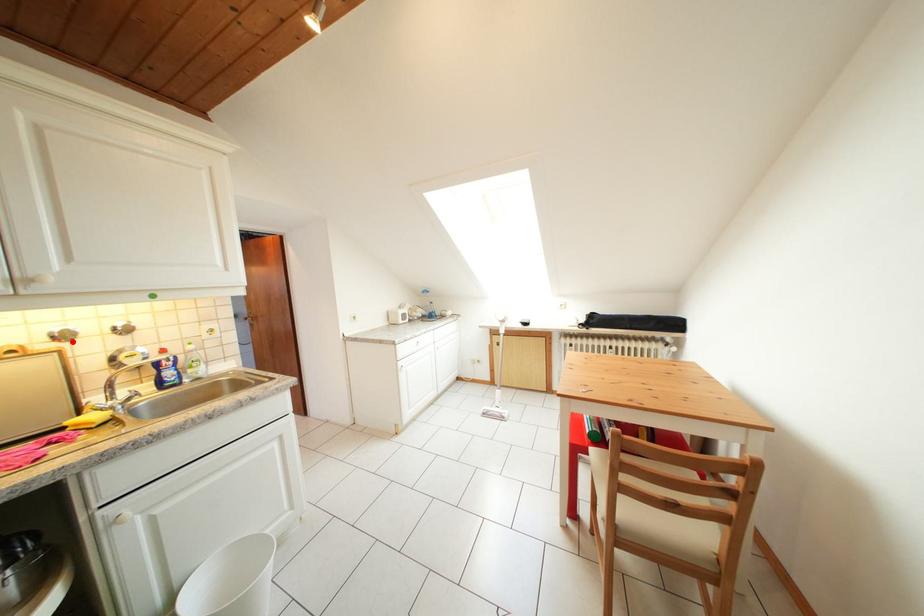
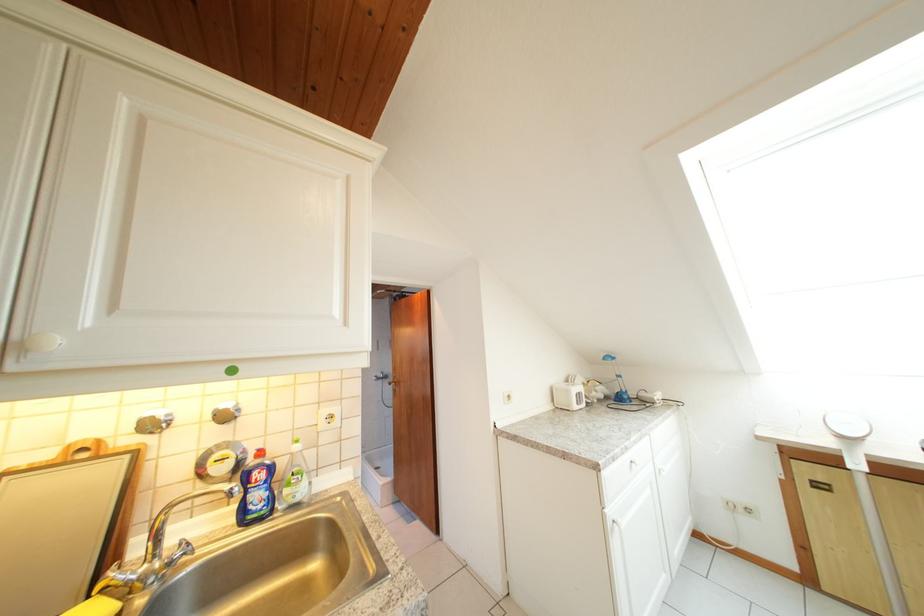
Find the pixel in the second image that matches the highlighted location in the first image.

(162, 431)